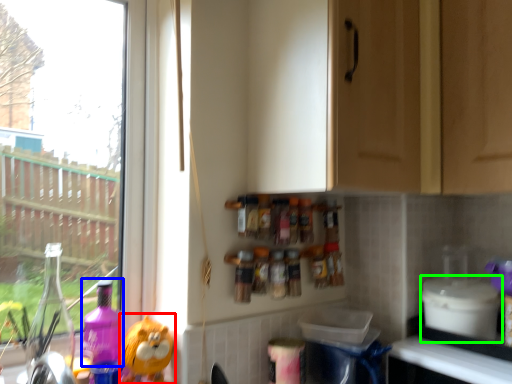
Question: Estimate the real-world distances between objects in this image. Which object is closer to toy (highlighted by a red box), cleaning product (highlighted by a blue box) or appliance (highlighted by a green box)?

Choices:
 (A) cleaning product
 (B) appliance

Answer: (A)